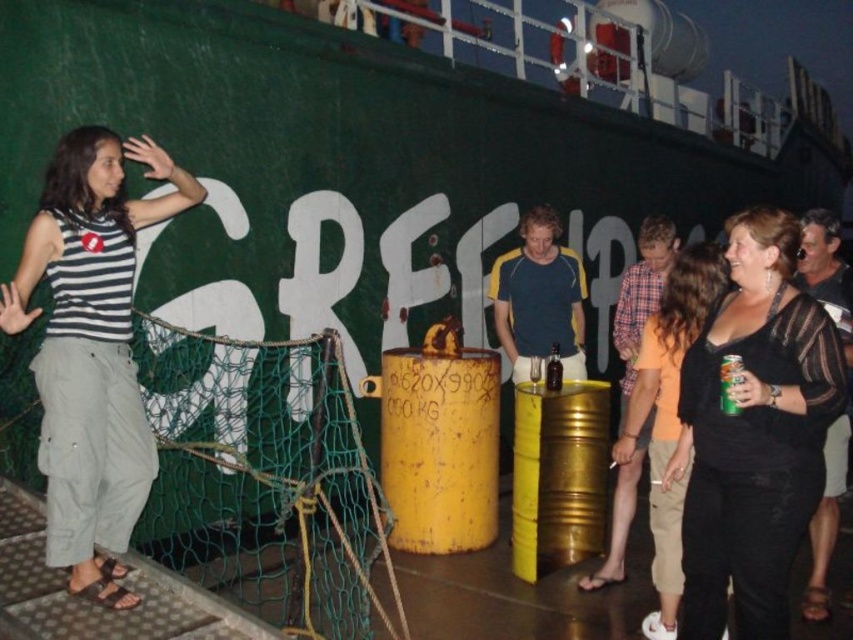
Question: Which of the following is the farthest from the observer?

Choices:
 (A) (401, 422)
 (B) (317, 579)

Answer: (A)

Question: Which point is farther to the camera?

Choices:
 (A) green matte can at center
 (B) orange matte shirt at center
 (C) green mesh net at center

Answer: (B)

Question: Can you confirm if yellow matte barrel at center is positioned to the right of yellow metallic barrel at center?

Choices:
 (A) no
 (B) yes

Answer: (A)

Question: Which is farther from the striped fabric shirt at left?

Choices:
 (A) orange matte shirt at center
 (B) black sheer top at center
 (C) yellow matte barrel at center
 (D) yellow metallic barrel at center

Answer: (D)

Question: Can you confirm if yellow metallic barrel at center is positioned to the left of orange matte shirt at center?

Choices:
 (A) no
 (B) yes

Answer: (B)

Question: Does yellow matte barrel at center appear under yellow metallic barrel at center?

Choices:
 (A) no
 (B) yes

Answer: (A)